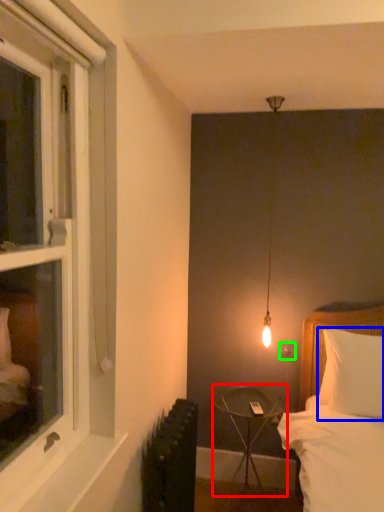
Question: Which object is the farthest from table (highlighted by a red box)? Choose among these: pillow (highlighted by a blue box) or electric outlet (highlighted by a green box).

Choices:
 (A) pillow
 (B) electric outlet

Answer: (A)